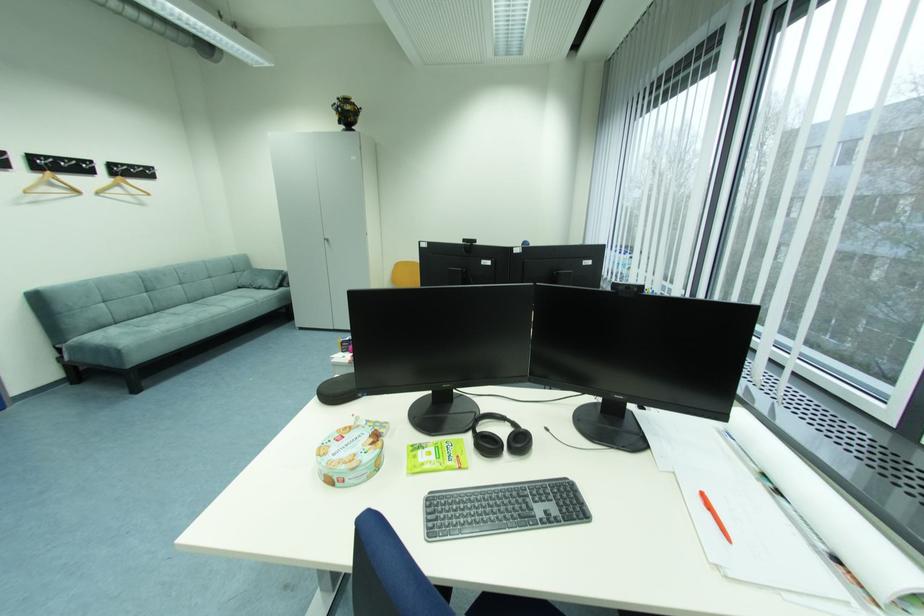
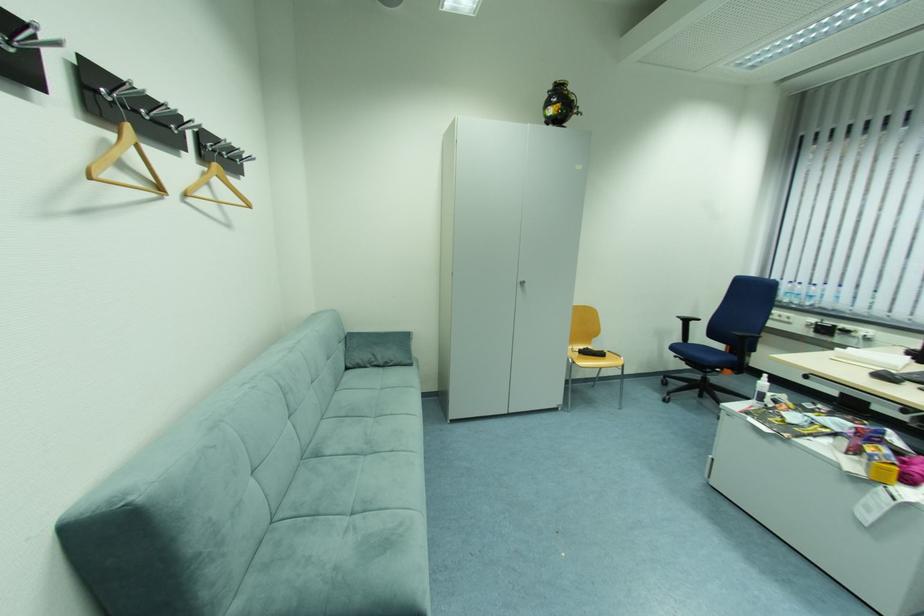
Locate, in the second image, the point that corresponds to point 130,185 in the first image.

(223, 182)